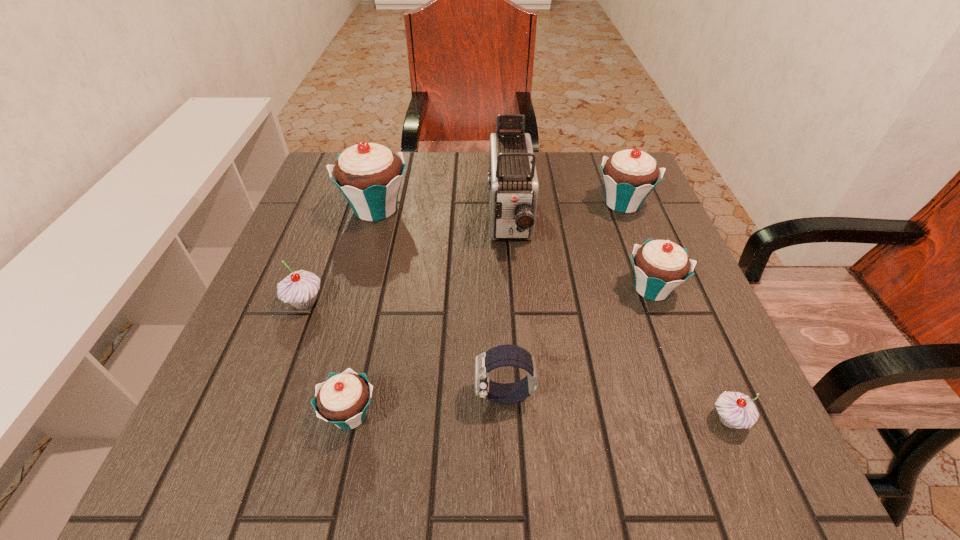
Find the location of a particular element. This screenshot has height=540, width=960. camcorder is located at coordinates (513, 187).

Where is `the biggest teal cupcake`? the biggest teal cupcake is located at coordinates (369, 175).

You are a GUI agent. You are given a task and a screenshot of the screen. Output one action in this format:
    pyautogui.click(x=<x>, y=<y>)
    Task: Click on the second tallest object
    
    Given the screenshot: What is the action you would take?
    pyautogui.click(x=369, y=175)

Identify the location of the second biggest teal cupcake. (629, 176).

At what (x,y) coordinates should I click in order to perform the action: click on the third tallest object. Please return your answer as a coordinate pair (x, y). Image resolution: width=960 pixels, height=540 pixels. Looking at the image, I should click on (629, 176).

The width and height of the screenshot is (960, 540). Identify the location of the left gray cupcake. (300, 288).

Image resolution: width=960 pixels, height=540 pixels. What are the coordinates of `the farther gray cupcake` in the screenshot? It's located at (300, 288).

Locate an element on the screen. the third farthest teal cupcake is located at coordinates (660, 266).

You are a GUI agent. You are given a task and a screenshot of the screen. Output one action in this format:
    pyautogui.click(x=<x>, y=<y>)
    Task: Click on the watch
    This screenshot has height=540, width=960.
    Given the screenshot: What is the action you would take?
    pyautogui.click(x=503, y=355)

Locate an element on the screen. Image resolution: width=960 pixels, height=540 pixels. the right gray cupcake is located at coordinates (736, 410).